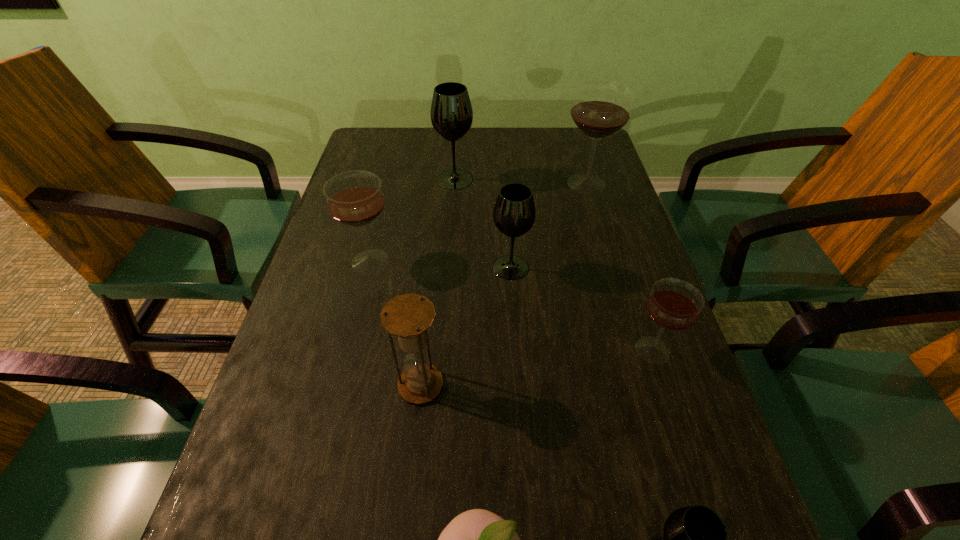
At what (x,y) coordinates should I click in order to perform the action: click on vacant region located 0.160m on the right of the farthest gray wineglass. Please return your answer as a coordinate pair (x, y). Looking at the image, I should click on (531, 179).

Find the location of a particular element. Image resolution: width=960 pixels, height=540 pixels. vacant space located on the front of the biggest red wineglass is located at coordinates (612, 271).

In order to click on vacant space located on the front of the leftmost red wineglass in this screenshot , I will do `click(324, 446)`.

At what (x,y) coordinates should I click in order to perform the action: click on free space located on the right of the second biggest gray wineglass. Please return your answer as a coordinate pair (x, y). Image resolution: width=960 pixels, height=540 pixels. Looking at the image, I should click on (628, 268).

Image resolution: width=960 pixels, height=540 pixels. Identify the location of free location located 0.350m on the back of the hourglass. (436, 240).

Find the location of `vacant space located 0.270m on the left of the smallest red wineglass`. vacant space located 0.270m on the left of the smallest red wineglass is located at coordinates (488, 350).

The width and height of the screenshot is (960, 540). I want to click on object located in the left edge section of the desktop, so click(354, 198).

In order to click on free location at the far edge of the desktop in this screenshot , I will do `click(423, 131)`.

Where is `vacant space at the left edge of the desktop`? This screenshot has height=540, width=960. vacant space at the left edge of the desktop is located at coordinates click(x=385, y=237).

In the image, there is a desktop. Identify the location of vacant space at the right edge. (612, 280).